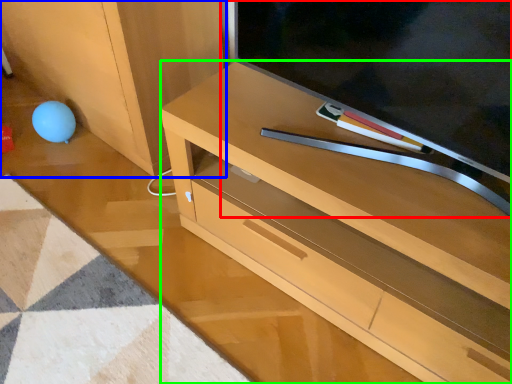
Question: Which is nearer to the television (highlighted by a red box)? cabinetry (highlighted by a blue box) or desk (highlighted by a green box).

Choices:
 (A) cabinetry
 (B) desk

Answer: (B)